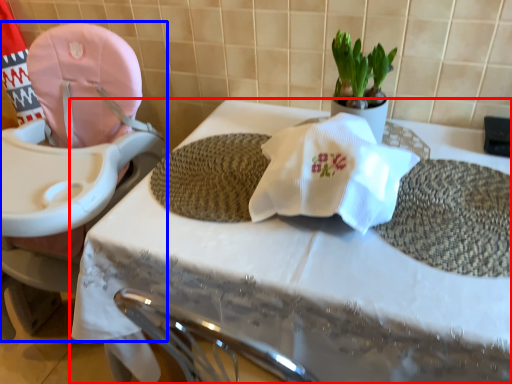
Question: Which point is further to the camera, table (highlighted by a red box) or baby carriage (highlighted by a blue box)?

Choices:
 (A) table
 (B) baby carriage

Answer: (B)